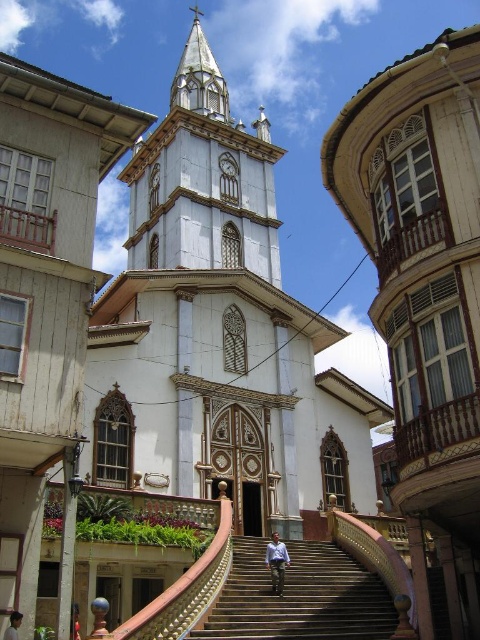
Question: In this image, where is white glossy steeple at center located relative to light blue shirt at center?

Choices:
 (A) right
 (B) left

Answer: (B)

Question: Is dark brown wooden stairs at center to the right of light blue shirt at center from the viewer's perspective?

Choices:
 (A) yes
 (B) no

Answer: (A)

Question: Does white glossy steeple at center have a greater width compared to light blue shirt at center?

Choices:
 (A) yes
 (B) no

Answer: (A)

Question: Which object is positioned closest to the dark brown wooden stairs at center?

Choices:
 (A) white glossy steeple at center
 (B) white marble clock tower at center

Answer: (B)

Question: Which point is closer to the camera?

Choices:
 (A) (12, 634)
 (B) (217, 92)
 (C) (186, 65)
 (D) (276, 561)

Answer: (A)

Question: Estimate the real-world distances between objects in this image. Which object is farther from the white glossy steeple at center?

Choices:
 (A) light brown hair at lower left
 (B) white marble clock tower at center

Answer: (A)